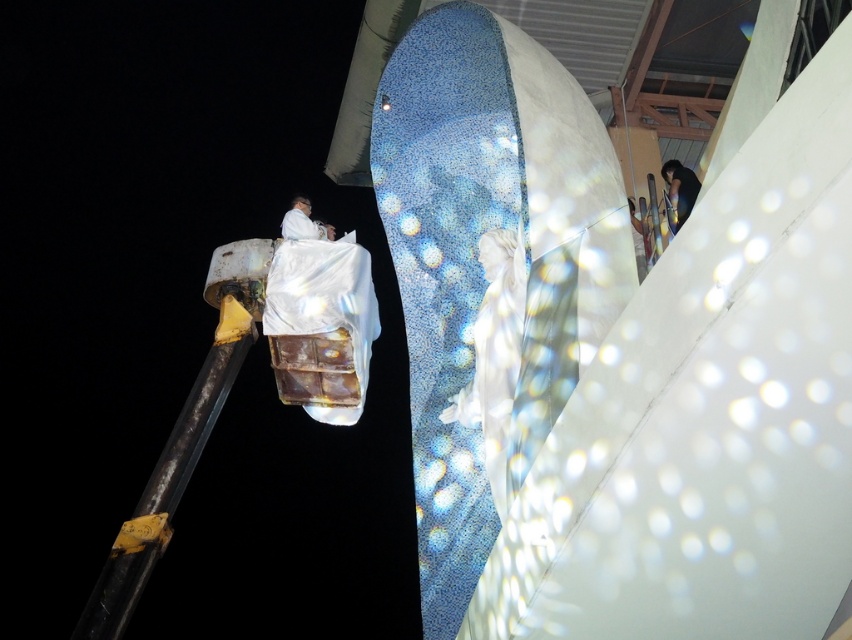
You are an art critic analyzing the sculpture installation. Based on the scene, which object is taller between the white glossy statue at center and the dark hair at upper right?

The white glossy statue at center is taller than the dark hair at upper right.

You are planning to install a new light fixture between the rusty metal pole at left and the white matte suit at upper center. The light fixture requires a minimum of 60 feet of space between the two objects to be safely installed. Based on the scene description, is the distance sufficient for installation?

The rusty metal pole at left and the white matte suit at upper center are 59.11 feet apart from each other. Since the required minimum distance is 60 feet, the space is insufficient for the light fixture installation.

You are an event planner setting up for a gala. You need to place a 1.2 meter wide decorative banner between the rusty metal pole at left and the white matte suit at upper center. Considering their sizes, will the banner fit without overlapping either object?

The rusty metal pole at left is bigger than the white matte suit at upper center. Since the banner is 1.2 meters wide, it might not fit if the space between them is narrower than 1.2 meters. However, the size comparison between the objects doesn